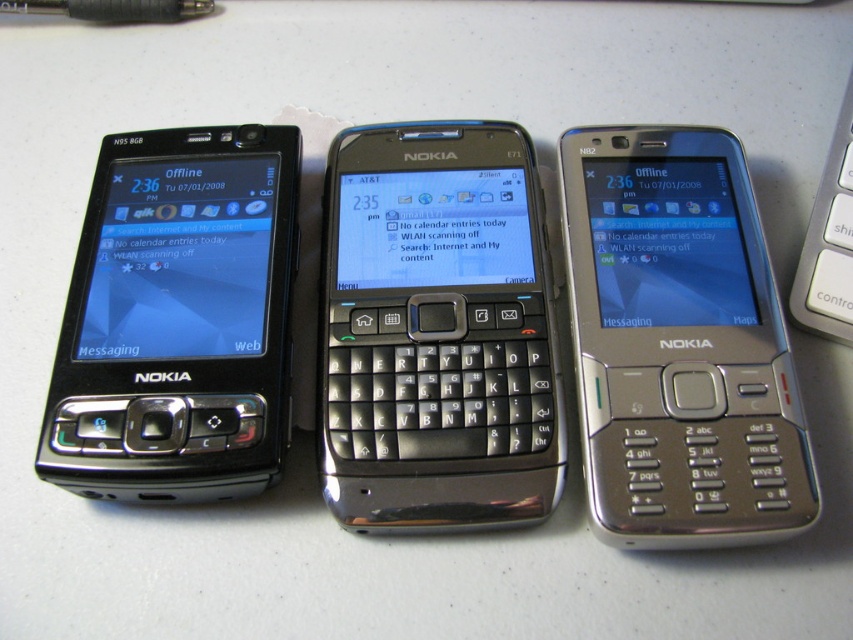
You are trying to place both the black matte nokia phone at left and the silver metallic keyboard at right on a shelf. Which object will require more vertical space due to its height?

The black matte nokia phone at left requires more vertical space because it is much taller than the silver metallic keyboard at right.

You are looking at the three Nokia phones arranged on the table. There are two points marked on the left phone. One is at coordinate point (360, 212) and the other at point (154, 132). From your perspective, which of these two points is closer to you?

Point (360, 212) is closer to you because it is further to the viewer than point (154, 132).

Where is the satin black phone at center located in the image?

The satin black phone at center is located at point (436, 332) in the image.